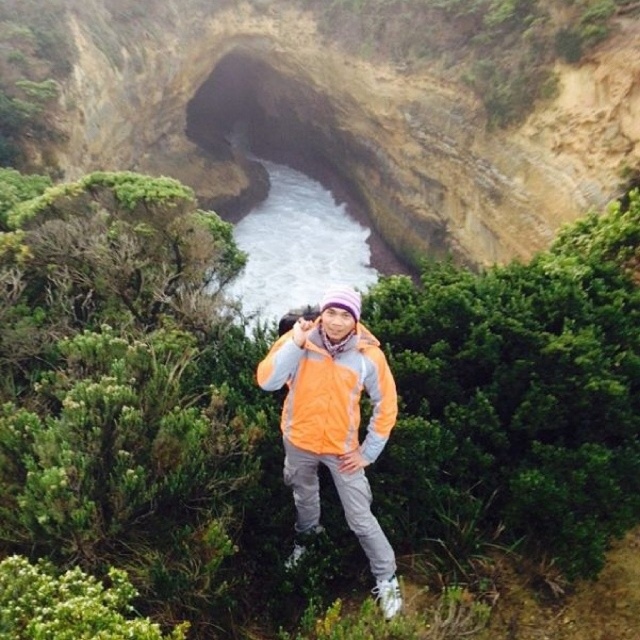
Consider the image. You are a photographer trying to adjust the focus of your camera to capture the orange fabric jacket at center. What are the coordinates where you should focus?

The orange fabric jacket at center is located at coordinates point (336, 422), so you should focus there.

You are a fashion designer observing the scene and notice two jackets at the center of the image. Which one is taller, the orange fabric jacket at center or the orange fleece jacket at center?

The orange fabric jacket at center is taller than the orange fleece jacket at center.

You are a photographer trying to capture the person in the image. You want to focus on the orange fabric jacket at center and the orange fleece jacket at center. Which jacket should you adjust your camera focus to first if you want to capture both clearly in the same frame?

The orange fabric jacket at center is positioned under the orange fleece jacket at center, so you should focus on the orange fleece jacket at center first to ensure both are in focus.